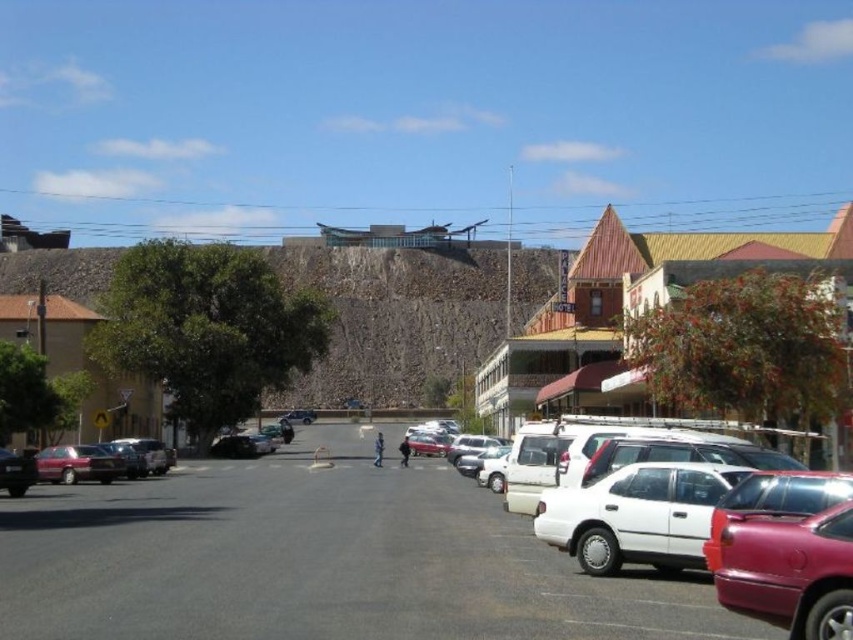
Question: Estimate the real-world distances between objects in this image. Which object is farther from the white matte sedan at right?

Choices:
 (A) matte red sedan at lower left
 (B) smooth concrete wall at center
 (C) white matte car at center

Answer: (B)

Question: Considering the relative positions of white matte car at center and white matte sedan at right in the image provided, where is white matte car at center located with respect to white matte sedan at right?

Choices:
 (A) left
 (B) right

Answer: (A)

Question: Based on their relative distances, which object is farther from the smooth concrete wall at center?

Choices:
 (A) white matte sedan at right
 (B) white matte car at center
 (C) matte red sedan at lower left

Answer: (C)

Question: Is white matte sedan at right to the left of matte red sedan at lower left from the viewer's perspective?

Choices:
 (A) no
 (B) yes

Answer: (A)

Question: Which point appears closest to the camera in this image?

Choices:
 (A) (456, 508)
 (B) (102, 480)

Answer: (A)

Question: Observing the image, what is the correct spatial positioning of smooth concrete wall at center in reference to matte red sedan at lower left?

Choices:
 (A) above
 (B) below

Answer: (A)